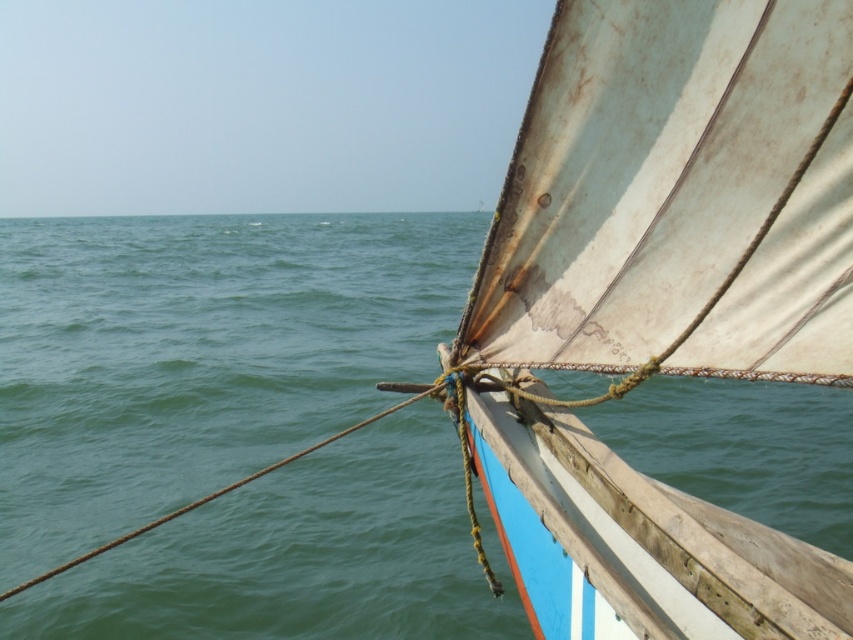
Who is higher up, green water at center or white tattered sail at upper right?

Positioned higher is green water at center.

Who is lower down, green water at center or white tattered sail at upper right?

white tattered sail at upper right is lower down.

Between point (236, 253) and point (498, 486), which one is positioned in front?

Point (498, 486)

Image resolution: width=853 pixels, height=640 pixels. In order to click on green water at center in this screenshot , I will do `click(196, 355)`.